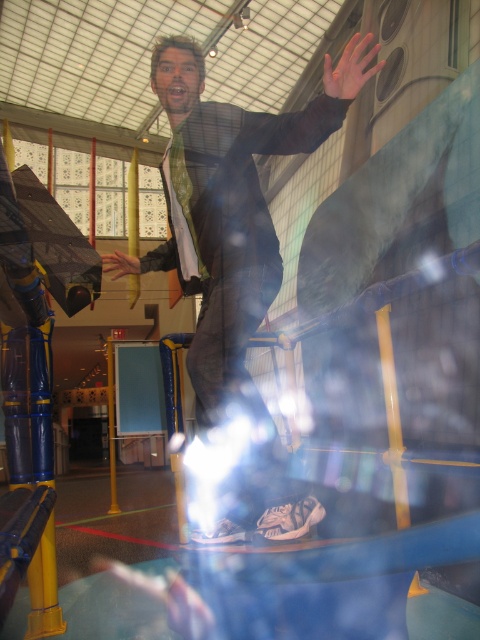
Question: Which point is farther to the camera?

Choices:
 (A) (354, 61)
 (B) (115, 275)

Answer: (B)

Question: Which point appears farthest from the camera in this image?

Choices:
 (A) (346, 74)
 (B) (115, 260)

Answer: (B)

Question: From the image, what is the correct spatial relationship of shiny black suit at center in relation to matte black hand at center?

Choices:
 (A) below
 (B) above

Answer: (A)

Question: Which object is the farthest from the shiny black suit at center?

Choices:
 (A) orange matte hand at upper center
 (B) matte black hand at center

Answer: (A)

Question: Does orange matte hand at upper center appear on the left side of matte black hand at center?

Choices:
 (A) yes
 (B) no

Answer: (B)

Question: Does shiny black suit at center appear over orange matte hand at upper center?

Choices:
 (A) yes
 (B) no

Answer: (B)